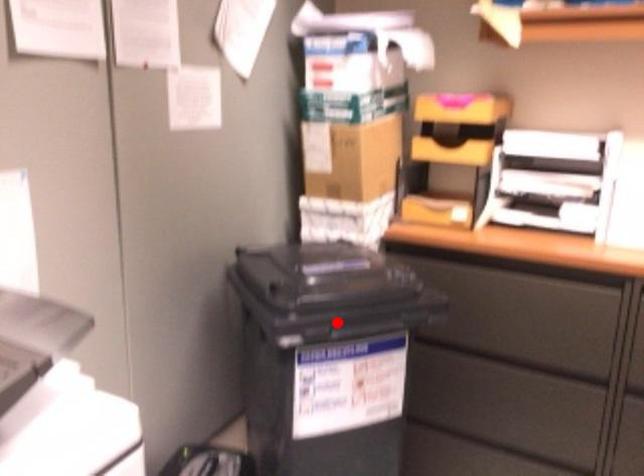
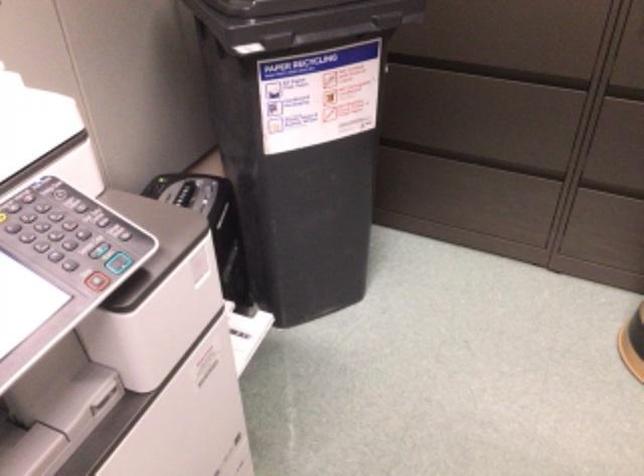
The point at the highlighted location is marked in the first image. Where is the corresponding point in the second image?

(298, 21)